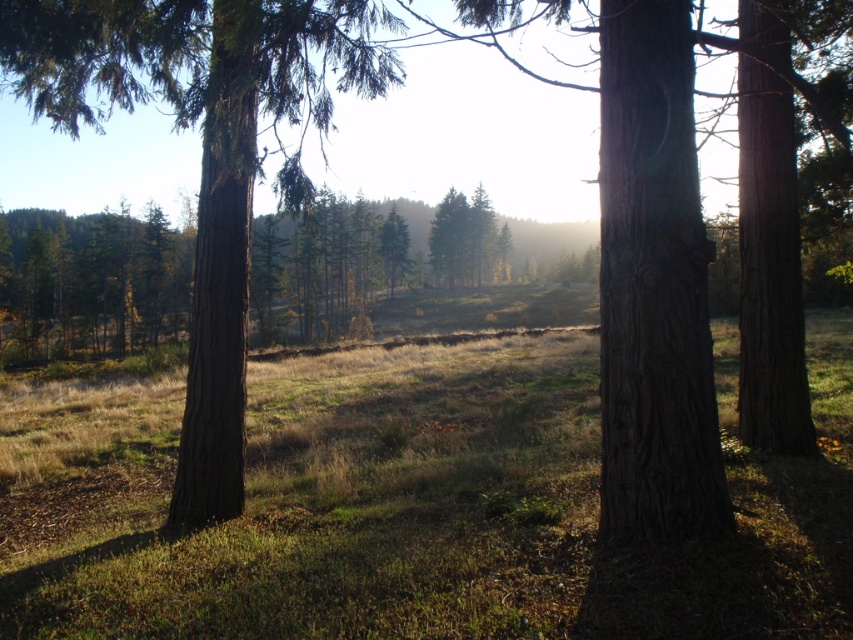
Is point (573, 412) farther from viewer compared to point (332, 67)?

That is False.

Based on the photo, can you confirm if green grassy field at center is positioned above smooth brown tree trunk at center?

Incorrect, green grassy field at center is not positioned above smooth brown tree trunk at center.

Which is behind, point (62, 612) or point (204, 433)?

Positioned behind is point (204, 433).

Find the location of `green grassy field at center`. green grassy field at center is located at coordinates (405, 508).